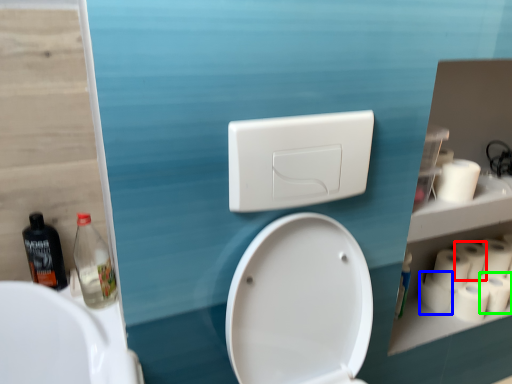
Question: Considering the real-world distances, which object is farthest from toilet paper (highlighted by a red box)? toilet paper (highlighted by a blue box) or toilet paper (highlighted by a green box)?

Choices:
 (A) toilet paper
 (B) toilet paper

Answer: (A)